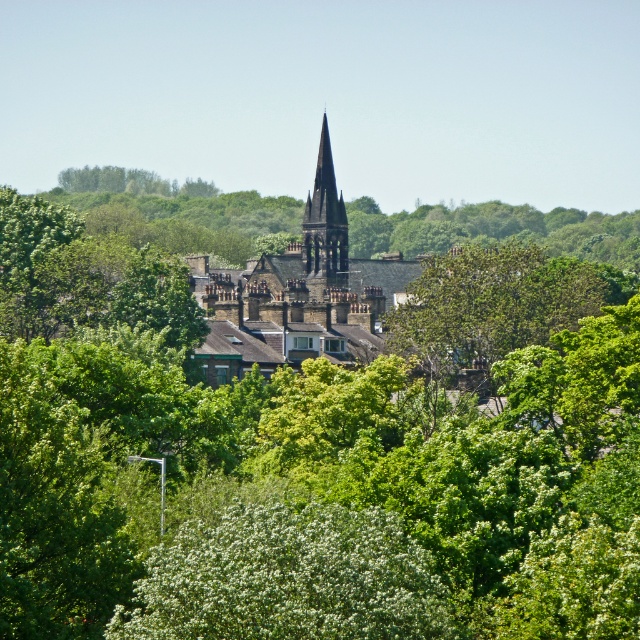
You are a drone operator tasked with capturing aerial footage of the dark gray stone church steeple at center. Your drone has a maximum flight range of 500 feet. Based on the scene description, can your drone safely reach the steeple without exceeding its range limit?

The dark gray stone church steeple at center is 495.29 feet from camera. Since the drone has a maximum flight range of 500 feet, it can safely reach the steeple as the distance is within the limit.

You are a city planner assessing the visual impact of structures in the urban landscape. Given the presence of the dark gray stone church steeple at center and the green leafy tree at center, which one would likely dominate the skyline more based on their sizes?

The dark gray stone church steeple at center is bigger than the green leafy tree at center, so it would dominate the skyline more due to its larger size.